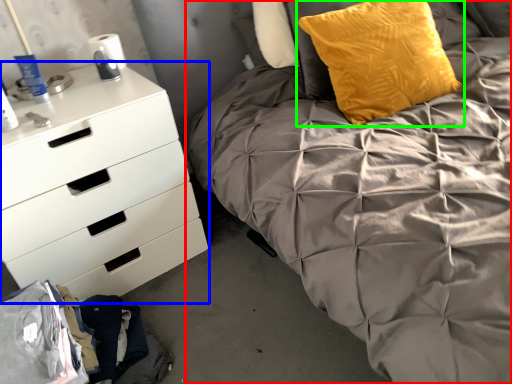
Question: Which is nearer to the bed (highlighted by a red box)? chest of drawers (highlighted by a blue box) or pillow (highlighted by a green box).

Choices:
 (A) chest of drawers
 (B) pillow

Answer: (B)